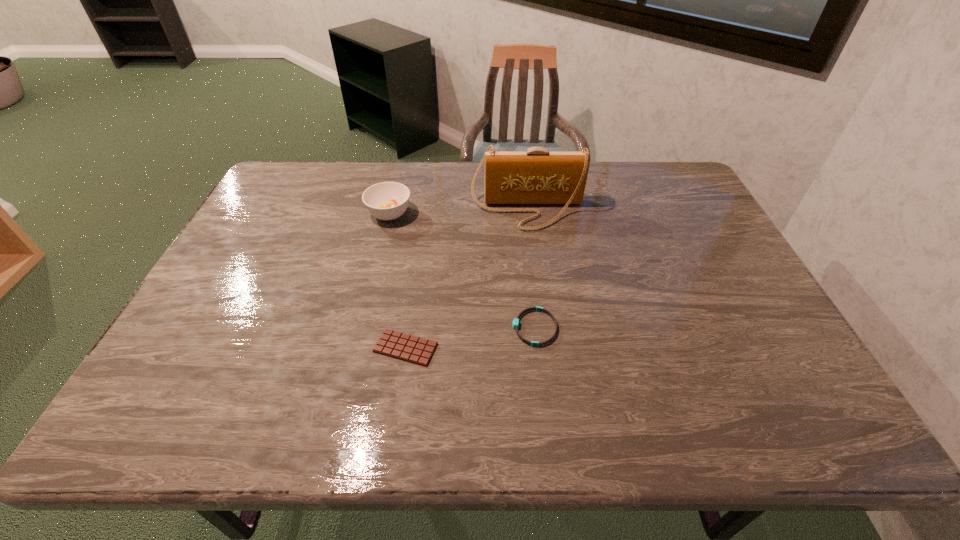
Where is `handbag`? handbag is located at coordinates (537, 176).

Where is `the third shortest object`? the third shortest object is located at coordinates (388, 200).

Where is `wristband`? wristband is located at coordinates (515, 324).

Find the location of a particular element. The width and height of the screenshot is (960, 540). the shortest object is located at coordinates (395, 344).

Find the location of a particular element. vacant space located 0.260m on the decorative side of the tallest object is located at coordinates (538, 294).

What are the coordinates of `vacant space located 0.310m on the left of the second tallest object` in the screenshot? It's located at (269, 214).

What are the coordinates of `free space located on the buckle of the third tallest object` in the screenshot? It's located at (414, 328).

The width and height of the screenshot is (960, 540). In order to click on vacant region located on the buckle of the third tallest object in this screenshot , I will do `click(365, 328)`.

Where is `vacant area situated on the buckle of the third tallest object`? vacant area situated on the buckle of the third tallest object is located at coordinates (353, 328).

Where is `free region located on the right of the shortest object`? This screenshot has width=960, height=540. free region located on the right of the shortest object is located at coordinates (527, 348).